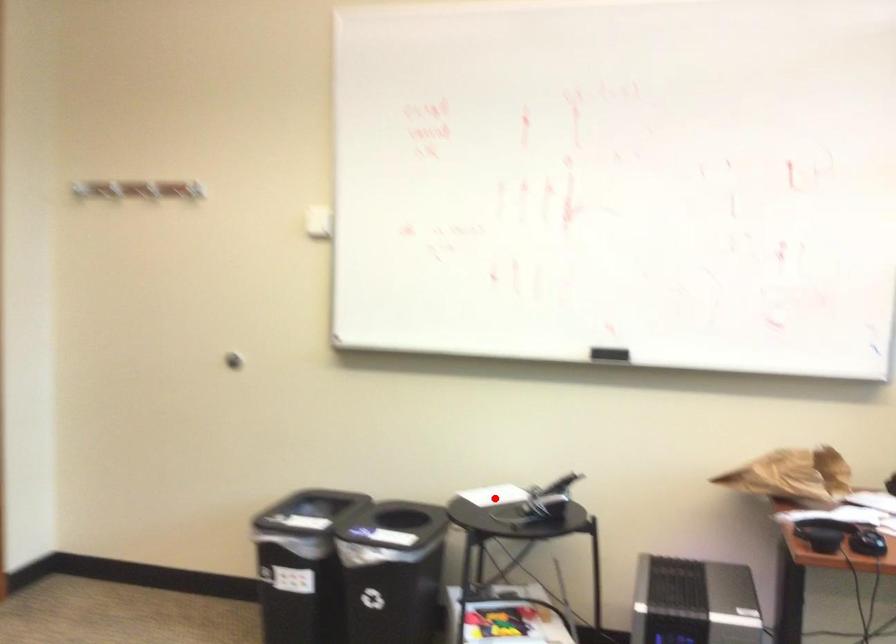
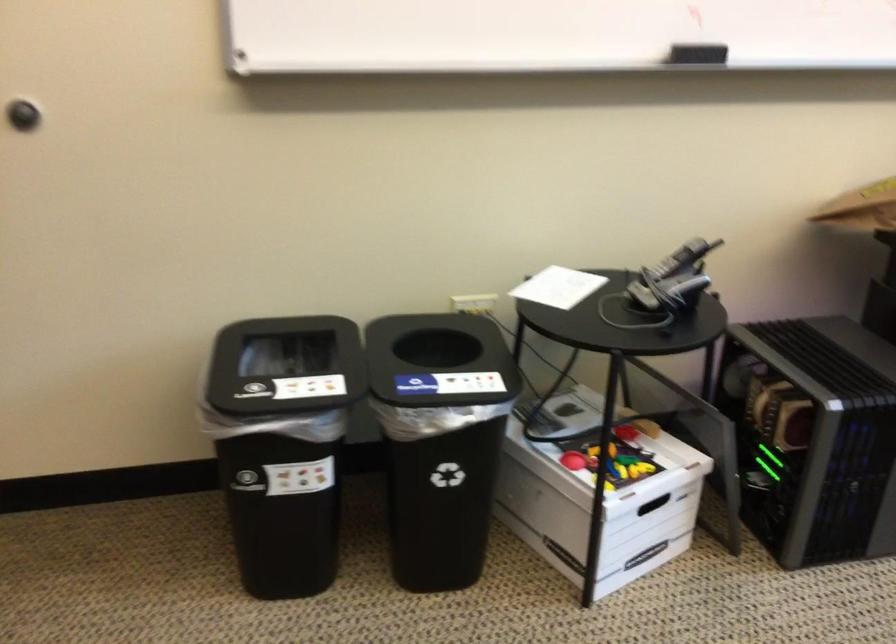
Locate, in the second image, the point that corresponds to the highlighted location in the first image.

(558, 287)